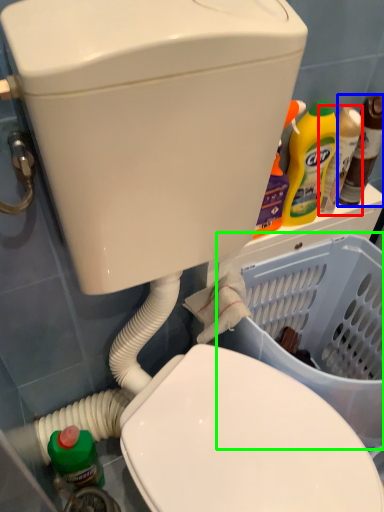
Question: Estimate the real-world distances between objects in this image. Which object is closer to bottle (highlighted by a red box), bottle (highlighted by a blue box) or basket container (highlighted by a green box)?

Choices:
 (A) bottle
 (B) basket container

Answer: (A)